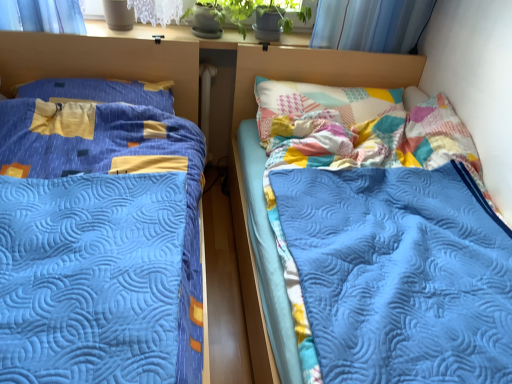
Question: From a real-world perspective, is patchwork fabric headboard at upper right on white matte radiator at center?

Choices:
 (A) yes
 (B) no

Answer: (A)

Question: Considering the relative positions of patchwork fabric headboard at upper right and white matte radiator at center in the image provided, is patchwork fabric headboard at upper right to the right of white matte radiator at center from the viewer's perspective?

Choices:
 (A) no
 (B) yes

Answer: (B)

Question: Does patchwork fabric headboard at upper right have a lesser width compared to white matte radiator at center?

Choices:
 (A) yes
 (B) no

Answer: (B)

Question: Is patchwork fabric headboard at upper right behind white matte radiator at center?

Choices:
 (A) no
 (B) yes

Answer: (A)

Question: Is patchwork fabric headboard at upper right far from white matte radiator at center?

Choices:
 (A) no
 (B) yes

Answer: (A)

Question: Is blue quilted bed at left, which is the 1th bed in left-to-right order, taller or shorter than white matte radiator at center?

Choices:
 (A) short
 (B) tall

Answer: (B)

Question: In the image, is blue quilted bed at left, arranged as the 2th bed when viewed from the right, positioned in front of or behind white matte radiator at center?

Choices:
 (A) front
 (B) behind

Answer: (A)

Question: Considering the relative positions of blue quilted bed at left, which is the 1th bed in left-to-right order, and white matte radiator at center in the image provided, is blue quilted bed at left, which is the 1th bed in left-to-right order, to the left or to the right of white matte radiator at center?

Choices:
 (A) right
 (B) left

Answer: (B)

Question: Is blue quilted bed at left, arranged as the 2th bed when viewed from the right, wider or thinner than white matte radiator at center?

Choices:
 (A) wide
 (B) thin

Answer: (A)

Question: Is point (252, 289) positioned closer to the camera than point (207, 74)?

Choices:
 (A) farther
 (B) closer

Answer: (B)

Question: Is blue quilted bed at right, which is the second bed from left to right, in front of or behind white matte radiator at center in the image?

Choices:
 (A) front
 (B) behind

Answer: (A)

Question: Is blue quilted bed at right, which is the second bed from left to right, wider or thinner than white matte radiator at center?

Choices:
 (A) thin
 (B) wide

Answer: (B)

Question: From a real-world perspective, is blue quilted bed at right, which is the first bed from right to left, positioned above or below white matte radiator at center?

Choices:
 (A) above
 (B) below

Answer: (B)

Question: Relative to matte blue pillow at left, is blue quilted bed at left, which is the 1th bed in left-to-right order, in front or behind?

Choices:
 (A) behind
 (B) front

Answer: (B)

Question: Looking at their shapes, would you say blue quilted bed at left, which is the 1th bed in left-to-right order, is wider or thinner than matte blue pillow at left?

Choices:
 (A) wide
 (B) thin

Answer: (A)